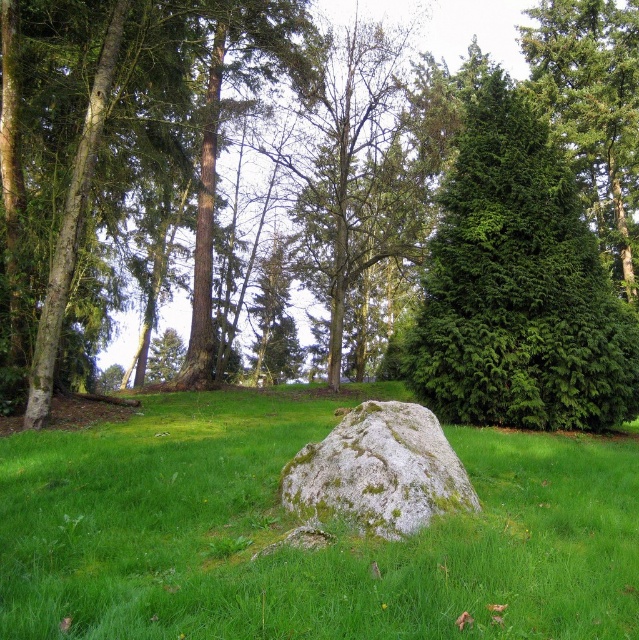
Who is shorter, green grassy at center or green textured evergreen tree at upper right?

green grassy at center

Can you confirm if green grassy at center is wider than green textured evergreen tree at upper right?

Yes.

What do you see at coordinates (291, 525) in the screenshot? The height and width of the screenshot is (640, 639). I see `green grassy at center` at bounding box center [291, 525].

Image resolution: width=639 pixels, height=640 pixels. Find the location of `green grassy at center`. green grassy at center is located at coordinates (291, 525).

Is green leafy tree at center further to camera compared to gray mossy rock at center?

Yes, it is behind gray mossy rock at center.

Can you confirm if green leafy tree at center is positioned below gray mossy rock at center?

No, green leafy tree at center is not below gray mossy rock at center.

Between point (334, 237) and point (390, 509), which one is positioned behind?

The point (334, 237) is more distant.

Image resolution: width=639 pixels, height=640 pixels. In order to click on green leafy tree at center in this screenshot , I will do `click(473, 212)`.

Which is behind, point (532, 172) or point (443, 460)?

The point (532, 172) is behind.

Find the location of a particular element. The image size is (639, 640). green textured evergreen tree at upper right is located at coordinates (518, 284).